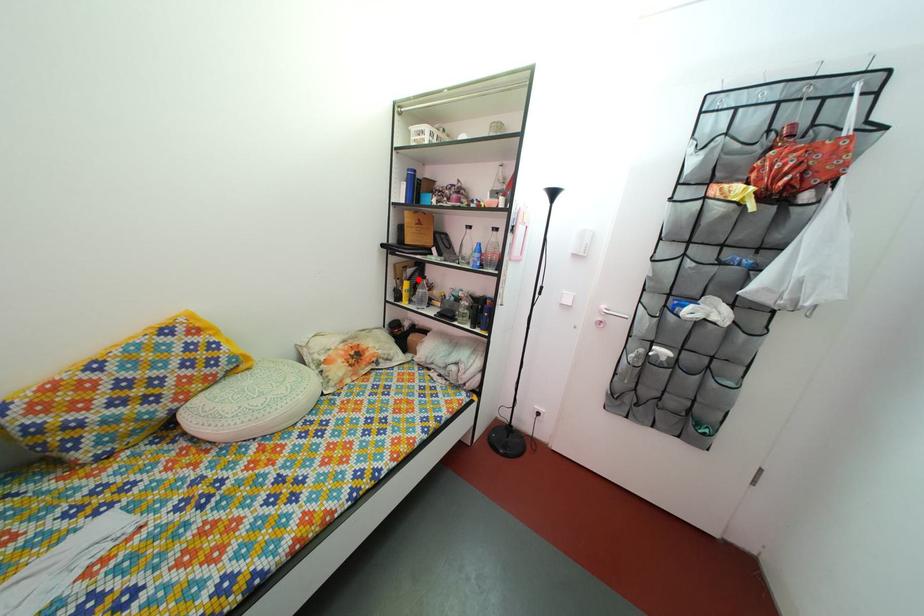
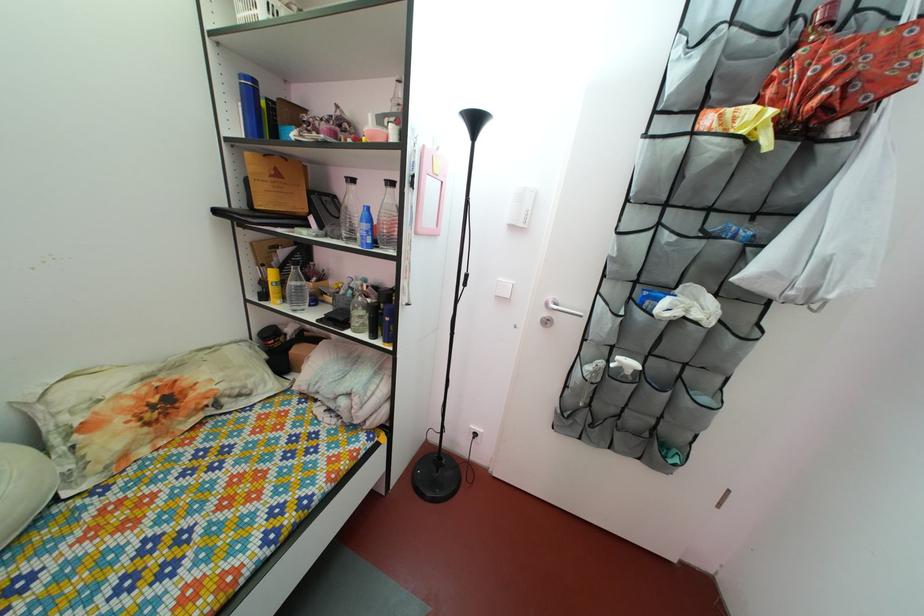
Find the pixel in the second image that matches the highlighted location in the first image.

(292, 262)